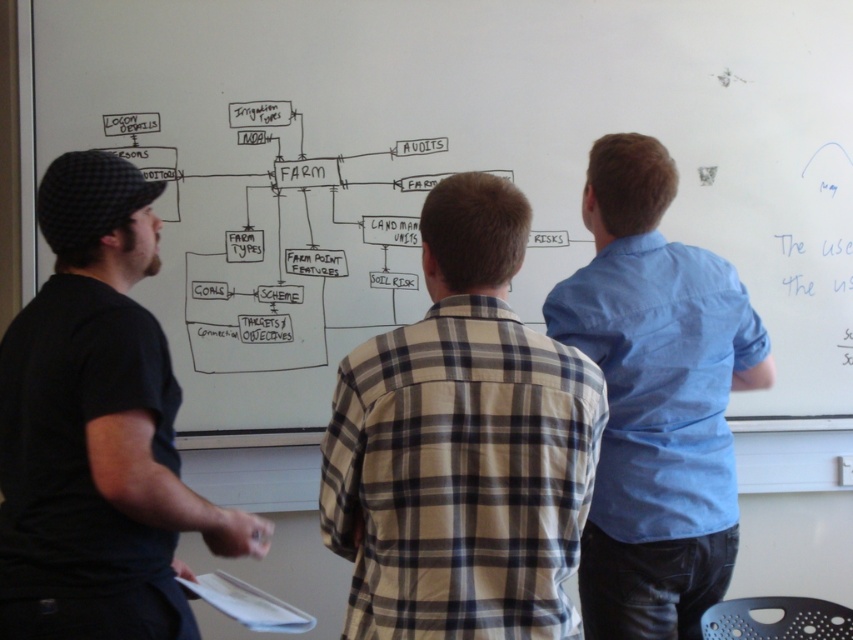
Can you confirm if whiteboard at upper center is positioned below plaid shirt at center?

No, whiteboard at upper center is not below plaid shirt at center.

Where is `whiteboard at upper center`? The width and height of the screenshot is (853, 640). whiteboard at upper center is located at coordinates (447, 168).

Is plaid shirt at center to the left of black cotton shirt at left from the viewer's perspective?

Incorrect, plaid shirt at center is not on the left side of black cotton shirt at left.

Is plaid shirt at center wider than black cotton shirt at left?

Yes.

Between point (598, 406) and point (136, 476), which one is positioned in front?

Positioned in front is point (136, 476).

Identify the location of plaid shirt at center. This screenshot has width=853, height=640. (462, 445).

Which of these two, black cotton shirt at left or light blue shirt at center, stands taller?

light blue shirt at center is taller.

Who is lower down, black cotton shirt at left or light blue shirt at center?

black cotton shirt at left is lower down.

Who is more forward, (103, 224) or (624, 474)?

Point (103, 224) is in front.

Where is `black cotton shirt at left`? The height and width of the screenshot is (640, 853). black cotton shirt at left is located at coordinates (97, 429).